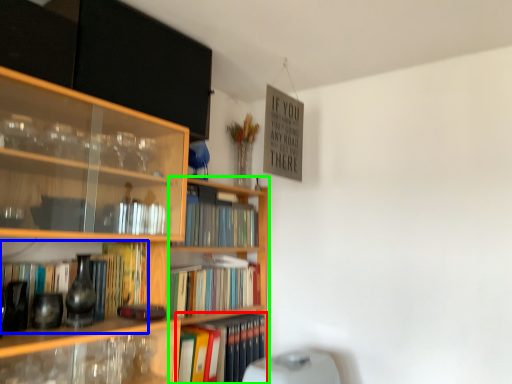
Question: Which is nearer to the book (highlighted by a red box)? book (highlighted by a blue box) or bookcase (highlighted by a green box).

Choices:
 (A) book
 (B) bookcase

Answer: (B)